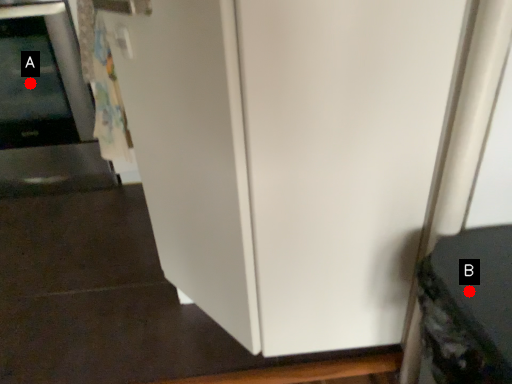
Question: Two points are circled on the image, labeled by A and B beside each circle. Which point is closer to the camera?

Choices:
 (A) A is closer
 (B) B is closer

Answer: (B)